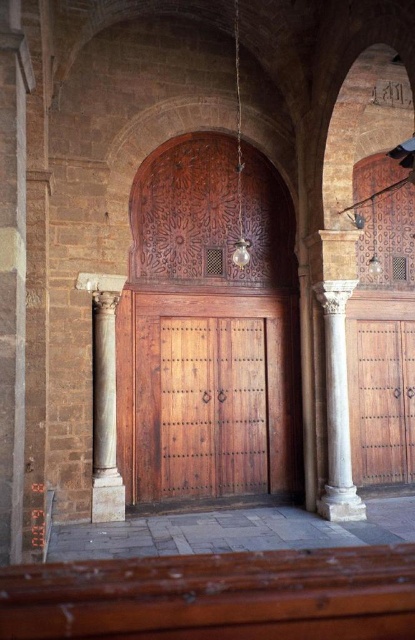
Question: Among these objects, which one is farthest from the camera?

Choices:
 (A) polished wood door at right
 (B) wooden door at center

Answer: (A)

Question: Which of these objects is positioned farthest from the white marble column at center?

Choices:
 (A) polished wood door at right
 (B) white marble column at left

Answer: (B)

Question: Estimate the real-world distances between objects in this image. Which object is closer to the white marble column at center?

Choices:
 (A) white marble column at left
 (B) wooden door at center
 (C) polished wood door at right

Answer: (B)

Question: Does polished wood door at right appear on the right side of white marble column at left?

Choices:
 (A) no
 (B) yes

Answer: (B)

Question: Does polished wood door at right have a greater width compared to white marble column at center?

Choices:
 (A) yes
 (B) no

Answer: (A)

Question: Is wooden door at center in front of white marble column at left?

Choices:
 (A) yes
 (B) no

Answer: (B)